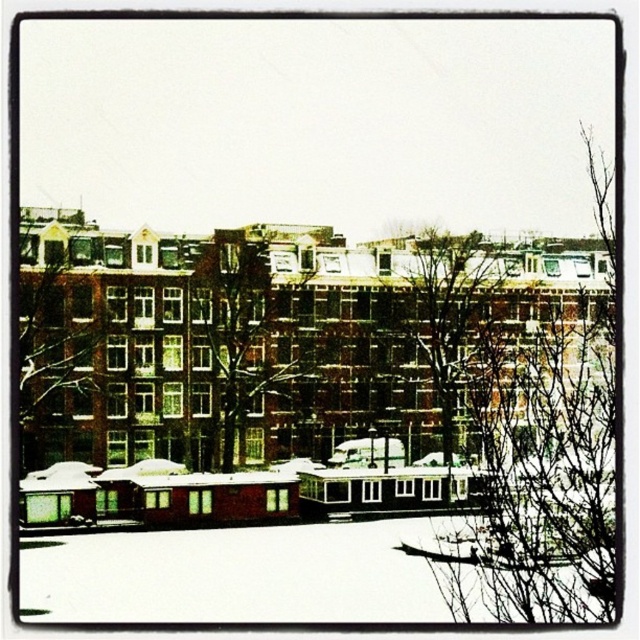
Measure the distance from bare branches at upper right to brown wooden tree at upper left.

126.82 feet

Which of these two, bare branches at upper right or brown wooden tree at upper left, stands shorter?

brown wooden tree at upper left is shorter.

Which is in front, point (456, 408) or point (58, 397)?

Point (58, 397) is more forward.

Where is `bare branches at upper right`? This screenshot has width=640, height=640. bare branches at upper right is located at coordinates (534, 428).

Who is taller, brown wooden tree at upper left or bare branches at center?

bare branches at center

Is brown wooden tree at upper left to the left of bare branches at center from the viewer's perspective?

Yes, brown wooden tree at upper left is to the left of bare branches at center.

In order to click on brown wooden tree at upper left in this screenshot , I will do `click(67, 337)`.

You are a GUI agent. You are given a task and a screenshot of the screen. Output one action in this format:
    pyautogui.click(x=<x>, y=<y>)
    Task: Click on the brown wooden tree at upper left
    The width and height of the screenshot is (640, 640).
    Given the screenshot: What is the action you would take?
    pyautogui.click(x=67, y=337)

How far apart are brown wooden tree at upper left and brown textured tree at center?

14.28 meters

Is point (92, 332) less distant than point (234, 317)?

That is True.

The height and width of the screenshot is (640, 640). Find the location of `brown wooden tree at upper left`. brown wooden tree at upper left is located at coordinates (67, 337).